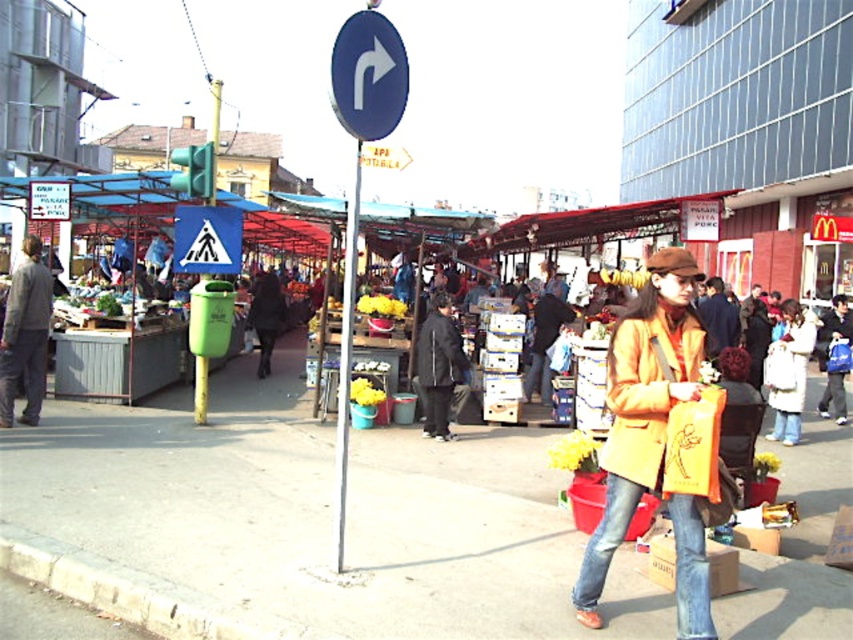
You are a pedestrian standing at the crosswalk and see the blue glossy sign at upper center and the white fuzzy coat at lower right. Which object is higher up in the image?

The blue glossy sign at upper center is above the white fuzzy coat at lower right, so it is higher up in the image.

Consider the image. You are a pedestrian approaching the crosswalk and see the blue metallic sign at center and the blue glossy sign at upper center. Which sign is positioned higher up in the scene?

The blue glossy sign at upper center is positioned higher up in the scene than the blue metallic sign at center.

You are a delivery person standing at the pedestrian crossing sign. You need to deliver a package to the location marked by point (368,131) and then to point (35,349). Which point should you visit first to follow the shortest path?

You should visit point (368,131) first because it is in front of point (35,349), so you can go to point (368,131) first and then proceed to point (35,349) without backtracking.